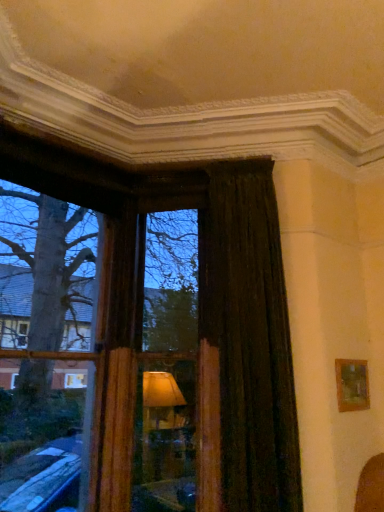
Question: Visually, is wooden frame at left positioned to the left or to the right of wooden frame at center?

Choices:
 (A) right
 (B) left

Answer: (B)

Question: Does point (16, 445) appear closer or farther from the camera than point (183, 221)?

Choices:
 (A) closer
 (B) farther

Answer: (A)

Question: Which object is positioned farthest from the wooden frame at center?

Choices:
 (A) wooden frame at left
 (B) dark velvet curtain at right
 (C) wooden picture frame at right

Answer: (C)

Question: Which object is the farthest from the wooden frame at left?

Choices:
 (A) wooden picture frame at right
 (B) wooden frame at center
 (C) dark velvet curtain at right

Answer: (A)